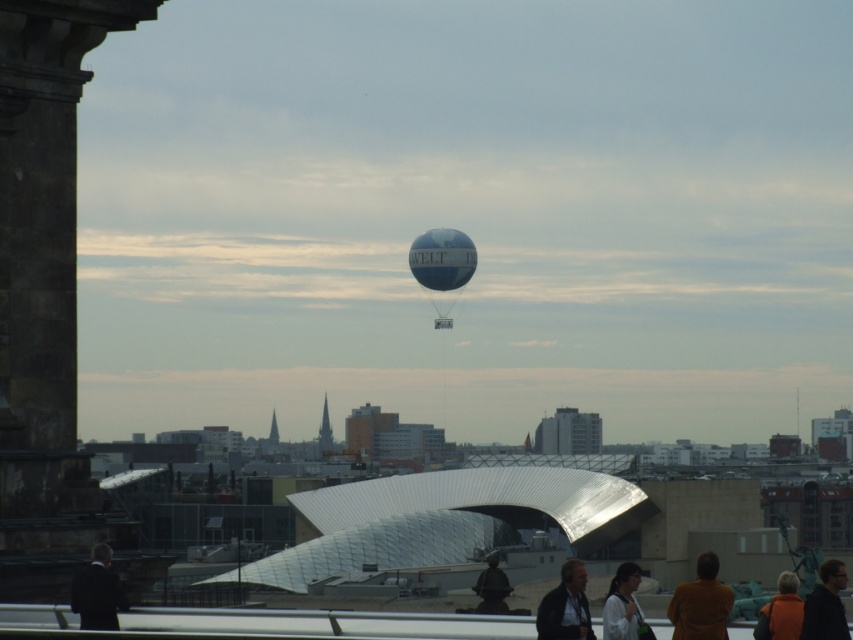
Between brown wool coat at lower right and dark blue jacket at lower center, which one has more height?

brown wool coat at lower right is taller.

Is point (711, 577) closer to viewer compared to point (538, 634)?

That is False.

This screenshot has width=853, height=640. Identify the location of brown wool coat at lower right. (701, 604).

Does brown wool coat at lower right appear over dark brown hair at lower right?

Incorrect, brown wool coat at lower right is not positioned above dark brown hair at lower right.

Does brown wool coat at lower right appear under dark brown hair at lower right?

Correct, brown wool coat at lower right is located below dark brown hair at lower right.

Locate an element on the screen. This screenshot has width=853, height=640. brown wool coat at lower right is located at coordinates (701, 604).

Does dark suit at lower left lie behind dark blue jacket at lower center?

No, it is not.

Does point (74, 611) lie in front of point (550, 627)?

Yes.

What do you see at coordinates (97, 592) in the screenshot? I see `dark suit at lower left` at bounding box center [97, 592].

Identify the location of dark suit at lower left. This screenshot has width=853, height=640. (97, 592).